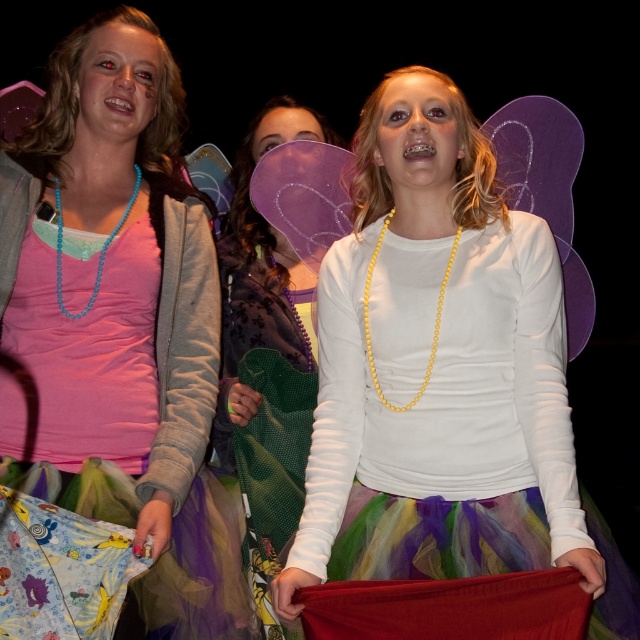
Question: Which of the following is the closest to the observer?

Choices:
 (A) (540, 358)
 (B) (76, 132)

Answer: (A)

Question: Does white matte tulle skirt at center appear under turquoise beaded necklace at left?

Choices:
 (A) no
 (B) yes

Answer: (B)

Question: Considering the relative positions of matte pink tulle skirt at lower left and yellow beaded necklace at center in the image provided, where is matte pink tulle skirt at lower left located with respect to yellow beaded necklace at center?

Choices:
 (A) right
 (B) left

Answer: (B)

Question: Which of the following is the closest to the observer?

Choices:
 (A) (0, 292)
 (B) (330, 132)
 (C) (97, 282)
 (D) (433, 296)

Answer: (A)

Question: Does white matte tulle skirt at center appear on the right side of turquoise beaded necklace at left?

Choices:
 (A) no
 (B) yes

Answer: (B)

Question: Which of the following is the farthest from the observer?

Choices:
 (A) white matte tulle skirt at center
 (B) yellow beaded necklace at center
 (C) turquoise beaded necklace at left
 (D) purple glitter fairy wings at center

Answer: (D)